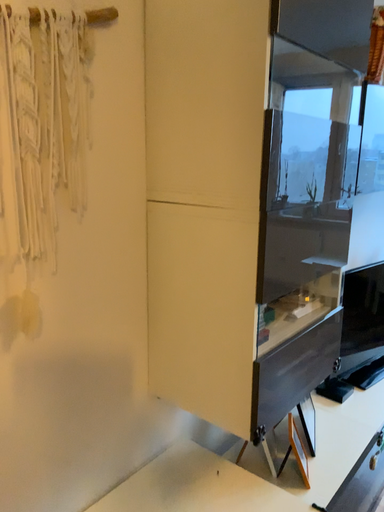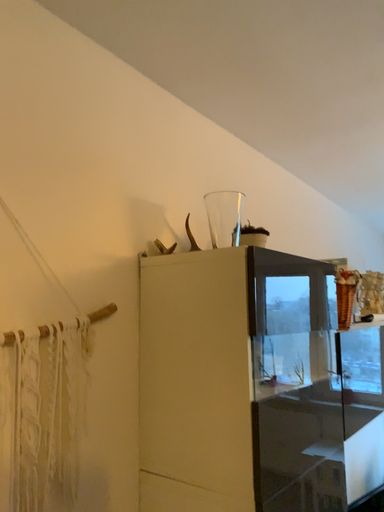
Question: Which way did the camera rotate in the video?

Choices:
 (A) rotated upward
 (B) rotated downward

Answer: (A)